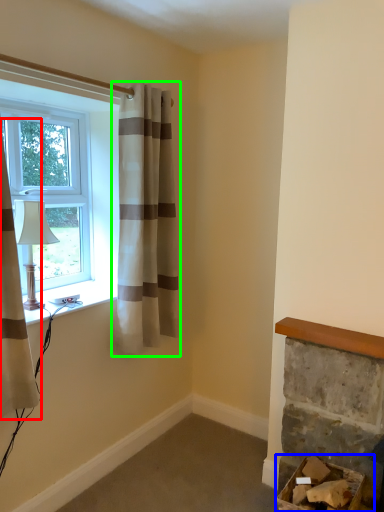
Question: Which object is positioned closest to curtain (highlighted by a red box)? Select from furniture (highlighted by a blue box) and curtain (highlighted by a green box).

Choices:
 (A) furniture
 (B) curtain

Answer: (B)